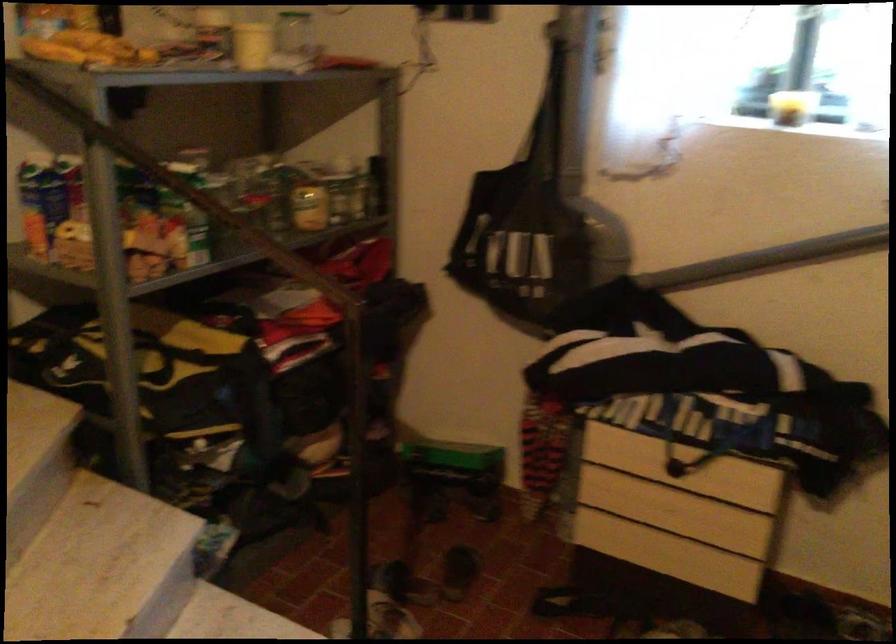
This screenshot has width=896, height=644. What are the coordinates of `yellow jar` in the screenshot? It's located at coord(309,205).